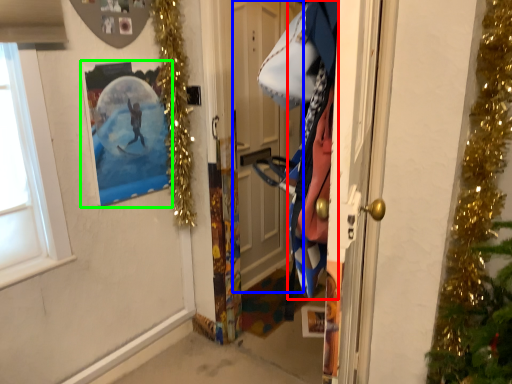
Question: Which object is the farthest from clothing (highlighted by a red box)? Choose among these: door (highlighted by a blue box) or picture frame (highlighted by a green box).

Choices:
 (A) door
 (B) picture frame

Answer: (A)